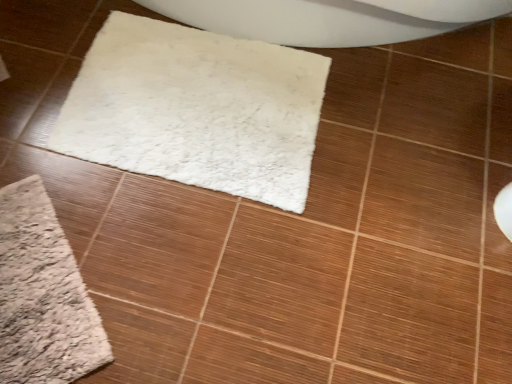
Find the location of `free space above beige fuzzy bath mat at lower left (from a real-world perspective)`. free space above beige fuzzy bath mat at lower left (from a real-world perspective) is located at coordinates point(32,293).